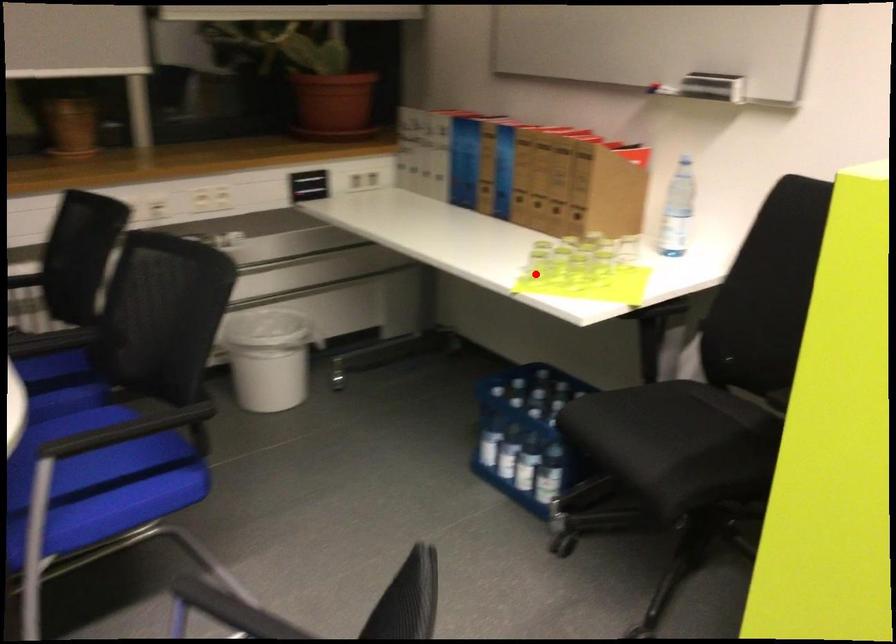
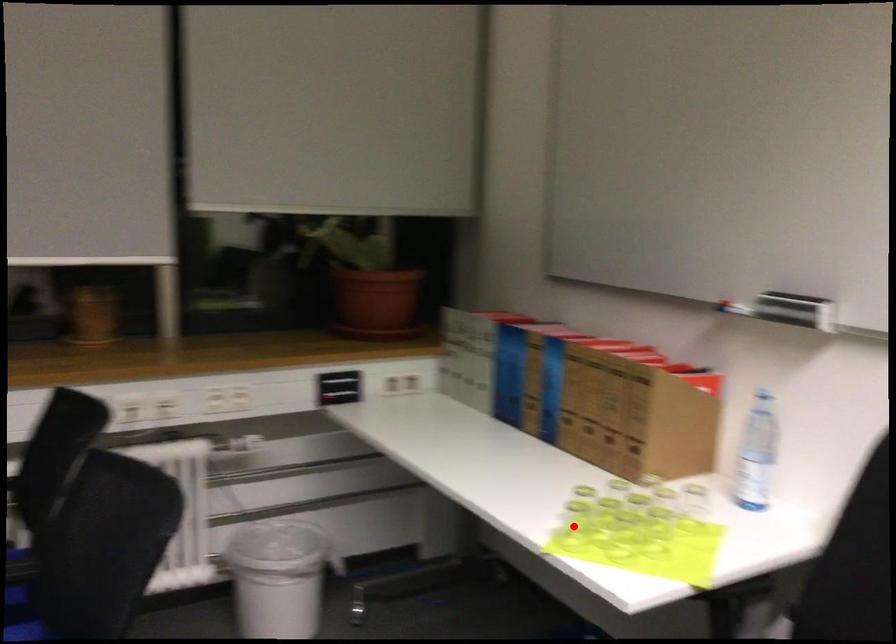
I am providing you with two images of the same scene from different viewpoints. A red point is marked on the first image and another point is marked on the second image. Are the points marked in image1 and image2 representing the same 3D position?

Yes